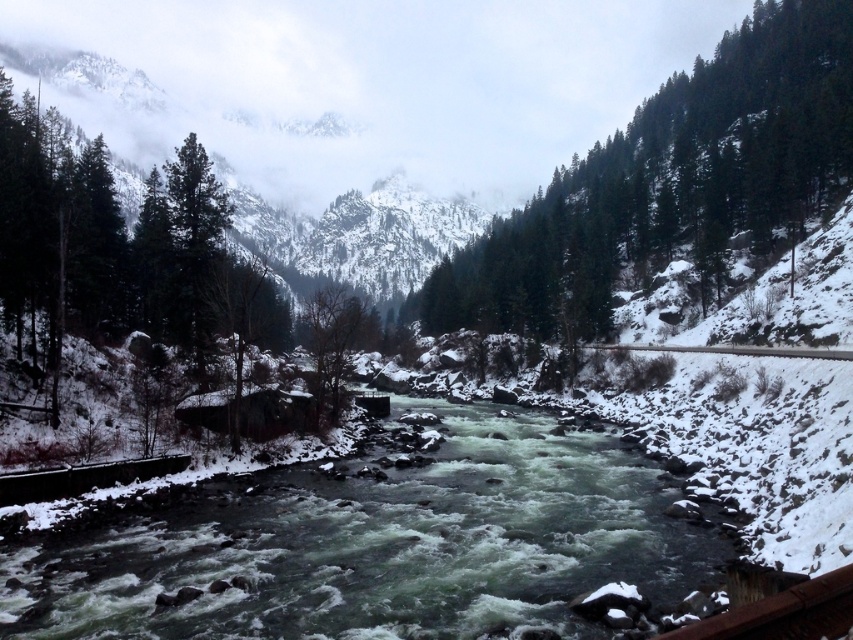
Does green textured tree at upper right lie in front of green matte tree at center?

No, it is behind green matte tree at center.

Consider the image. Does green textured tree at upper right appear on the left side of green matte tree at center?

No, green textured tree at upper right is not to the left of green matte tree at center.

This screenshot has height=640, width=853. Describe the element at coordinates (669, 182) in the screenshot. I see `green textured tree at upper right` at that location.

Find the location of a particular element. The image size is (853, 640). green textured tree at upper right is located at coordinates (669, 182).

Who is lower down, snowy rocky mountain at upper center or green matte tree at center?

green matte tree at center

Does point (450, 244) come farther from viewer compared to point (222, 218)?

That is True.

Is point (430, 260) in front of point (204, 182)?

No, (430, 260) is behind (204, 182).

Where is `snowy rocky mountain at upper center`? This screenshot has width=853, height=640. snowy rocky mountain at upper center is located at coordinates (352, 236).

Who is taller, green textured tree at upper right or snowy rocky mountain at upper center?

snowy rocky mountain at upper center is taller.

Can you confirm if green textured tree at upper right is taller than snowy rocky mountain at upper center?

Incorrect, green textured tree at upper right's height is not larger of snowy rocky mountain at upper center's.

The height and width of the screenshot is (640, 853). Describe the element at coordinates (669, 182) in the screenshot. I see `green textured tree at upper right` at that location.

You are a GUI agent. You are given a task and a screenshot of the screen. Output one action in this format:
    pyautogui.click(x=<x>, y=<y>)
    Task: Click on the green textured tree at upper right
    The width and height of the screenshot is (853, 640).
    Given the screenshot: What is the action you would take?
    pyautogui.click(x=669, y=182)